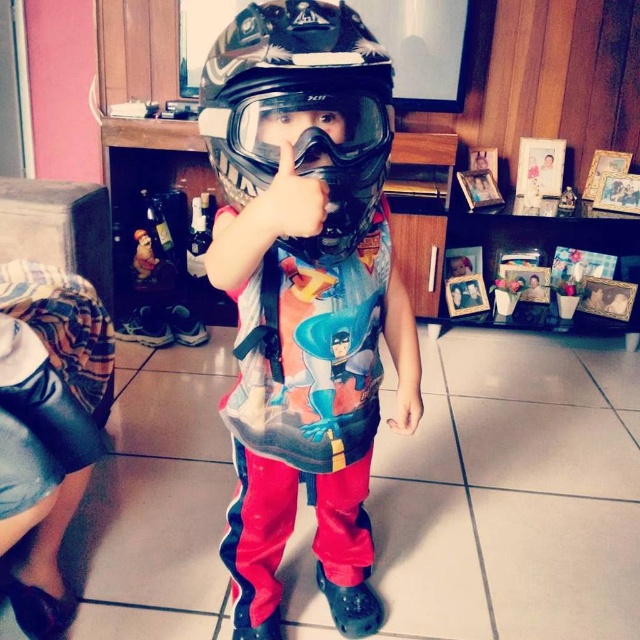
Question: Does matte black helmet at center have a greater width compared to camouflage matte helmet at center?

Choices:
 (A) yes
 (B) no

Answer: (A)

Question: Which point is closer to the camera?

Choices:
 (A) camouflage matte helmet at center
 (B) matte black helmet at center

Answer: (B)

Question: Where is matte black helmet at center located in relation to camouflage matte helmet at center in the image?

Choices:
 (A) below
 (B) above

Answer: (A)

Question: Which object is farther from the camera taking this photo?

Choices:
 (A) matte black helmet at center
 (B) camouflage matte helmet at center

Answer: (B)

Question: Can you confirm if matte black helmet at center is bigger than camouflage matte helmet at center?

Choices:
 (A) no
 (B) yes

Answer: (B)

Question: Which of the following is the farthest from the observer?

Choices:
 (A) (298, 449)
 (B) (250, 93)

Answer: (A)